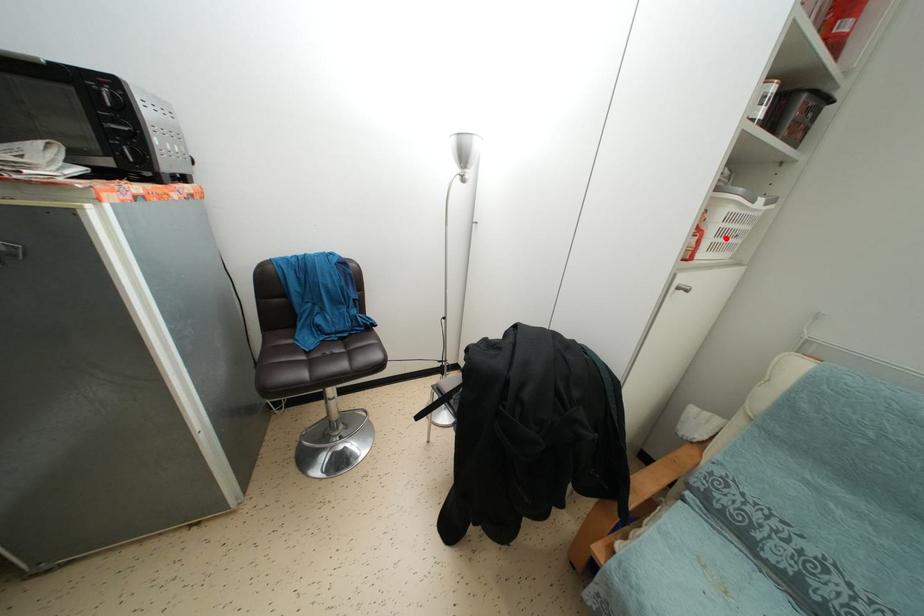
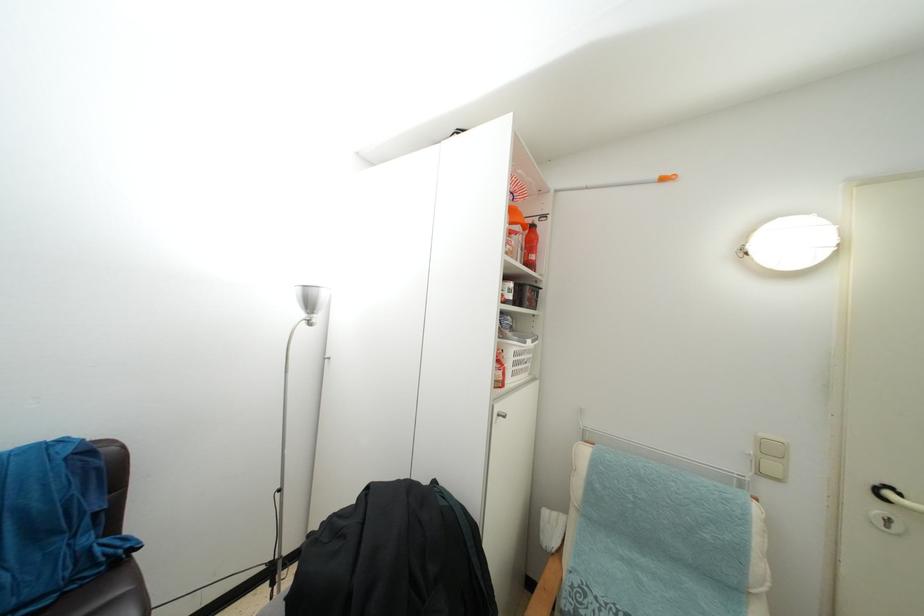
Where in the second image is the point corresponding to the highlighted location from the first image?

(519, 370)